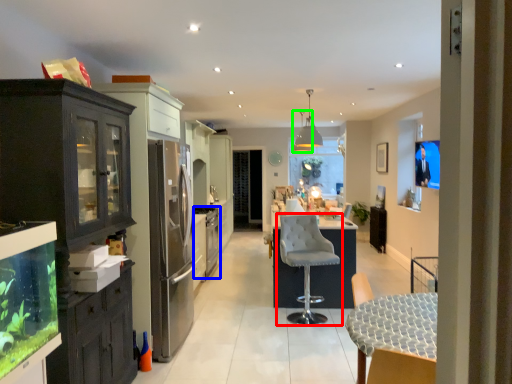
Question: Which object is the farthest from chair (highlighted by a red box)? Choose among these: appliance (highlighted by a blue box) or lamp (highlighted by a green box).

Choices:
 (A) appliance
 (B) lamp

Answer: (B)